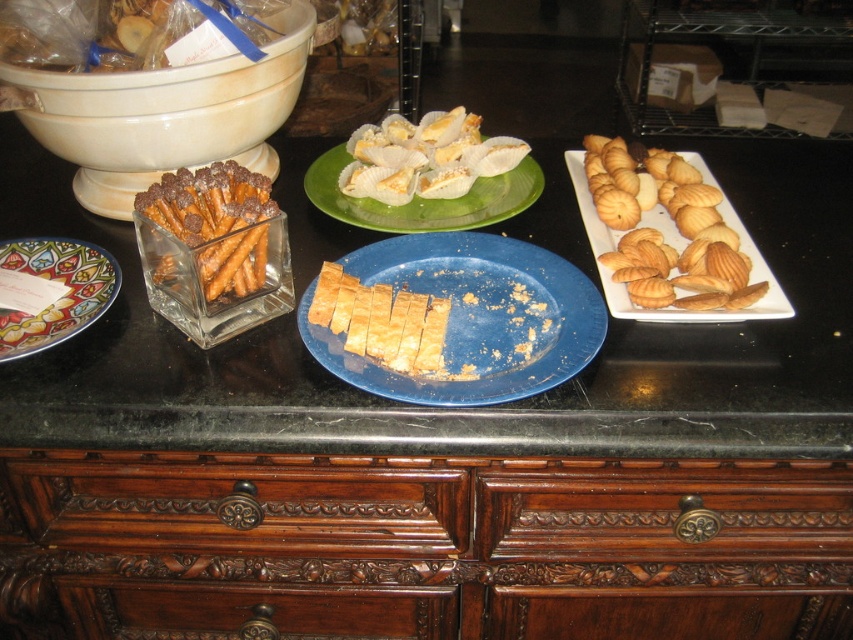
Does blue matte plate at center have a greater width compared to green matte plate at center?

No, blue matte plate at center is not wider than green matte plate at center.

Who is more distant from viewer, (454,301) or (325,180)?

Point (325,180)

In order to click on blue matte plate at center in this screenshot , I will do `click(474, 316)`.

Between dark brown wood drawer at center and green matte plate at center, which one is positioned higher?

green matte plate at center is higher up.

Can you confirm if dark brown wood drawer at center is positioned to the left of green matte plate at center?

Incorrect, dark brown wood drawer at center is not on the left side of green matte plate at center.

Measure the distance between point (397, 540) and camera.

30.76 inches

In order to click on dark brown wood drawer at center in this screenshot , I will do `click(421, 547)`.

Is point (693, 179) positioned in front of point (177, 211)?

No, it is not.

Measure the distance between point [664,298] and camera.

Point [664,298] is 29.95 inches away from camera.

Locate an element on the screen. golden crispy cookies at right is located at coordinates (663, 234).